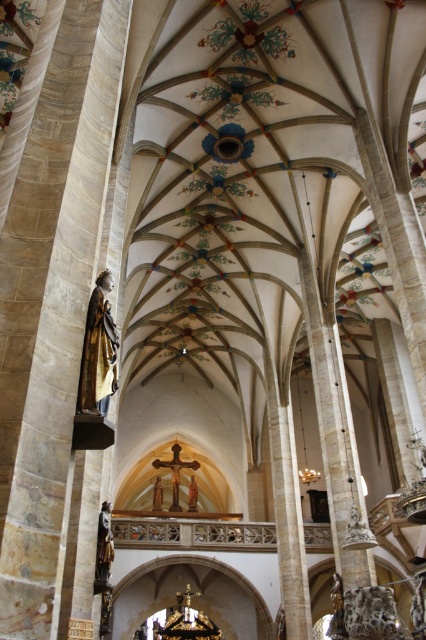
Question: Does polished bronze statue at left appear over polished bronze statue at lower left?

Choices:
 (A) no
 (B) yes

Answer: (B)

Question: Which of the following is the farthest from the observer?

Choices:
 (A) (100, 572)
 (B) (175, 448)

Answer: (B)

Question: Does polished bronze statue at left lie behind wooden cross at center?

Choices:
 (A) no
 (B) yes

Answer: (A)

Question: Which point appears farthest from the camera in this image?

Choices:
 (A) (106, 577)
 (B) (86, 323)

Answer: (A)

Question: Which point is closer to the camera?

Choices:
 (A) wooden cross at center
 (B) polished bronze statue at lower left
 (C) polished bronze statue at left

Answer: (C)

Question: Does polished bronze statue at left appear under polished bronze statue at lower left?

Choices:
 (A) no
 (B) yes

Answer: (A)